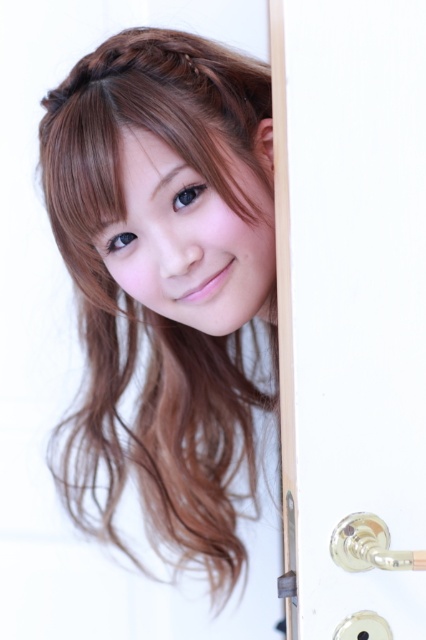
Can you confirm if silver metallic door handle at lower right is thinner than gold metallic lock at right?

In fact, silver metallic door handle at lower right might be wider than gold metallic lock at right.

Can you confirm if silver metallic door handle at lower right is wider than gold metallic lock at right?

Yes.

Where is `silver metallic door handle at lower right`? The width and height of the screenshot is (426, 640). silver metallic door handle at lower right is located at coordinates (370, 545).

Where is `silver metallic door handle at lower right`? silver metallic door handle at lower right is located at coordinates (370, 545).

Is gold metallic door handle at right in front of silver metallic door handle at lower right?

No, gold metallic door handle at right is further to the viewer.

Between gold metallic door handle at right and silver metallic door handle at lower right, which one appears on the right side from the viewer's perspective?

Positioned to the right is silver metallic door handle at lower right.

Looking at this image, who is more forward, (356,273) or (388,570)?

Point (388,570) is more forward.

This screenshot has width=426, height=640. I want to click on gold metallic door handle at right, so click(351, 292).

Is point (222, 170) positioned after point (420, 570)?

Yes.

Between point (198, 515) and point (356, 529), which one is positioned in front?

Point (356, 529) is more forward.

The height and width of the screenshot is (640, 426). I want to click on smooth brown hair at center, so pos(146,300).